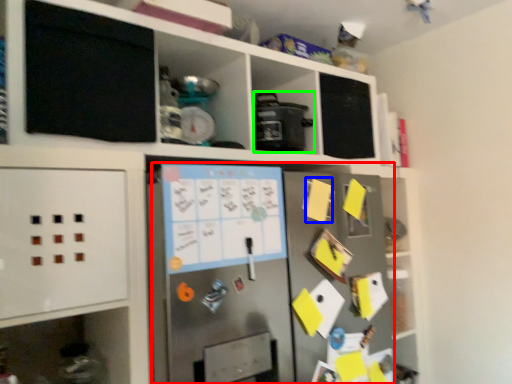
Question: Which object is the farthest from fridge (highlighted by a red box)? Choose among these: note (highlighted by a blue box) or appliance (highlighted by a green box).

Choices:
 (A) note
 (B) appliance

Answer: (B)